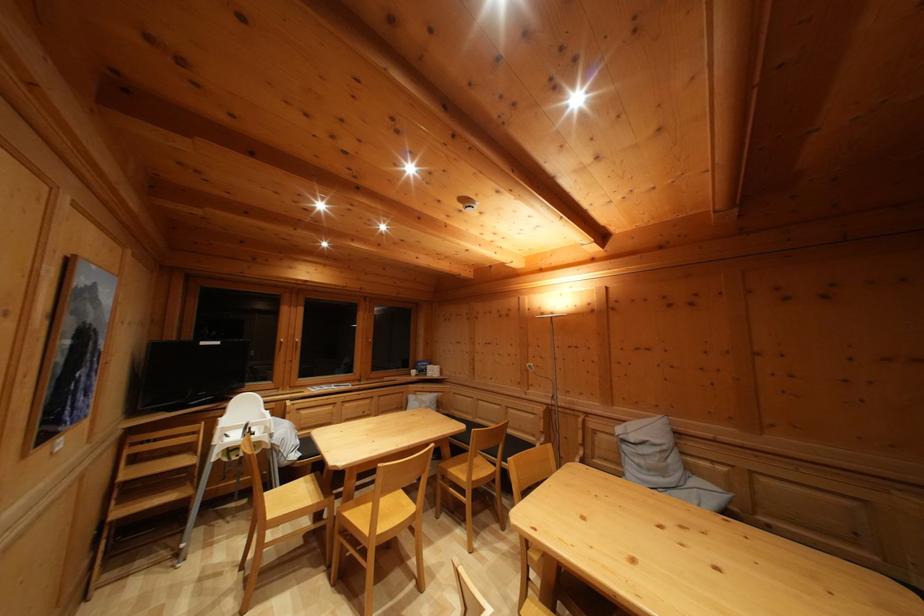
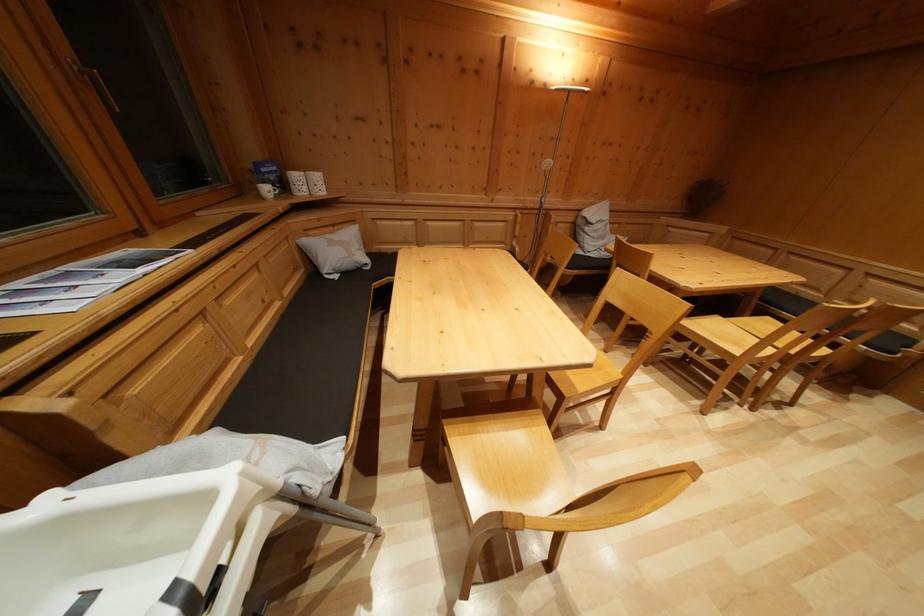
Where in the second image is the point corresponding to (x=436, y=399) from the first image?

(338, 233)